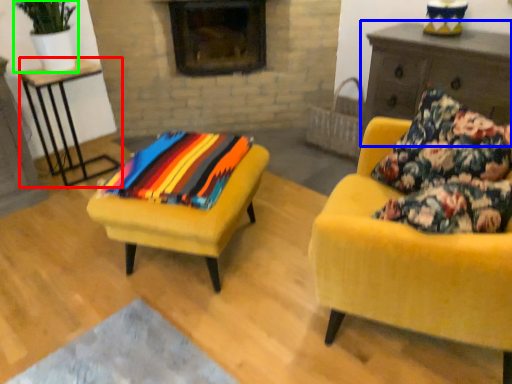
Question: Estimate the real-world distances between objects in this image. Which object is farther from table (highlighted by a red box), dresser (highlighted by a blue box) or houseplant (highlighted by a green box)?

Choices:
 (A) dresser
 (B) houseplant

Answer: (A)